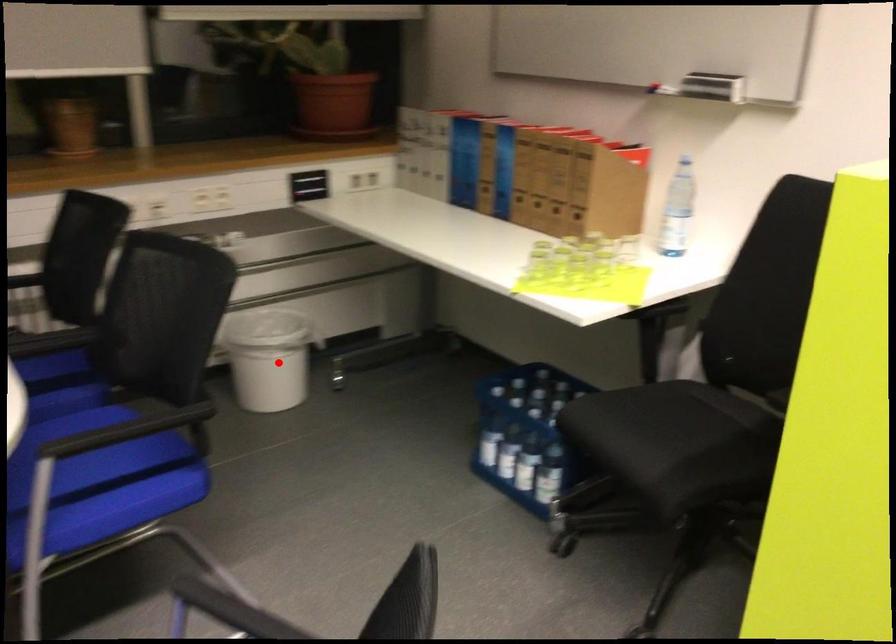
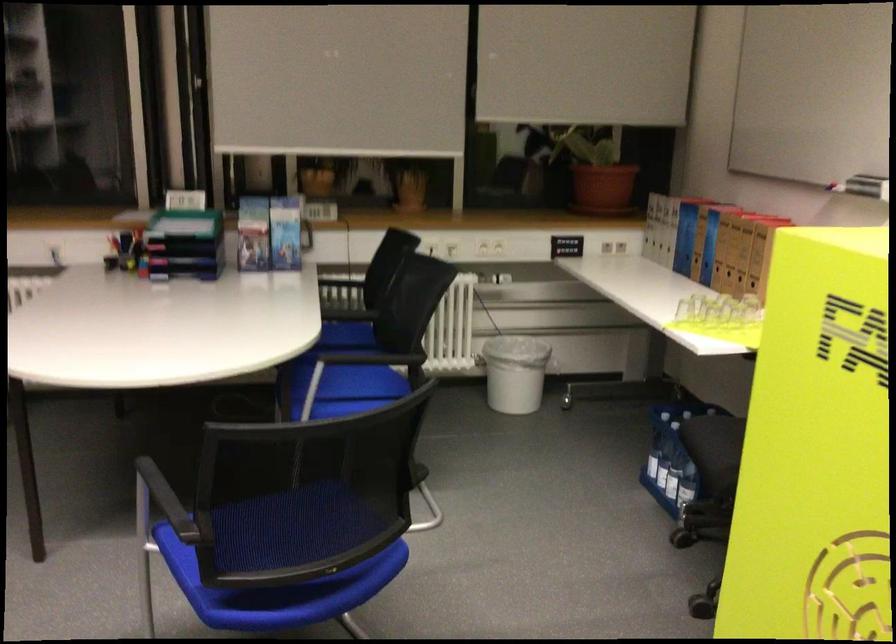
Locate, in the second image, the point that corresponds to the highlighted location in the first image.

(514, 373)